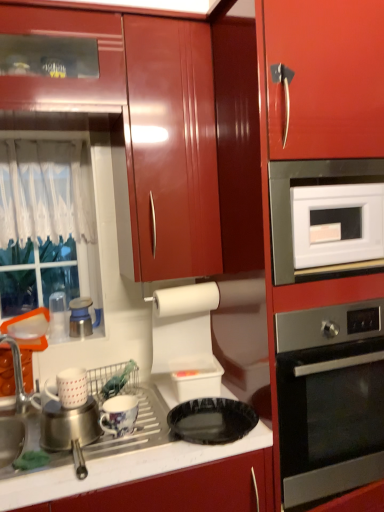
Question: Is black glossy plate at lower center not near glossy ceramic mug at lower center, positioned as the third appliance in left-to-right order?

Choices:
 (A) yes
 (B) no

Answer: (B)

Question: From a real-world perspective, is black glossy plate at lower center positioned under glossy ceramic mug at lower center, marked as the second appliance in a front-to-back arrangement, based on gravity?

Choices:
 (A) no
 (B) yes

Answer: (B)

Question: Is black glossy plate at lower center oriented towards glossy ceramic mug at lower center, which is counted as the 3th appliance, starting from the top?

Choices:
 (A) yes
 (B) no

Answer: (B)

Question: From the image's perspective, is black glossy plate at lower center located above glossy ceramic mug at lower center, positioned as the third appliance in left-to-right order?

Choices:
 (A) no
 (B) yes

Answer: (A)

Question: From the image's perspective, is black glossy plate at lower center under glossy ceramic mug at lower center, which ranks as the second appliance in back-to-front order?

Choices:
 (A) yes
 (B) no

Answer: (A)

Question: Choose the correct answer: Is black glossy plate at lower center inside glossy wood cabinet at upper center or outside it?

Choices:
 (A) outside
 (B) inside

Answer: (A)

Question: From a real-world perspective, is black glossy plate at lower center positioned above or below glossy wood cabinet at upper center?

Choices:
 (A) above
 (B) below

Answer: (B)

Question: Relative to glossy wood cabinet at upper center, is black glossy plate at lower center in front or behind?

Choices:
 (A) front
 (B) behind

Answer: (B)

Question: From the image's perspective, is black glossy plate at lower center positioned above or below glossy wood cabinet at upper center?

Choices:
 (A) below
 (B) above

Answer: (A)

Question: Is point (72, 323) closer or farther from the camera than point (304, 409)?

Choices:
 (A) farther
 (B) closer

Answer: (A)

Question: From a real-world perspective, is satin silver kettle at upper left, which appears as the 1th appliance when viewed from the top, positioned above or below stainless steel oven at right?

Choices:
 (A) below
 (B) above

Answer: (B)

Question: Is satin silver kettle at upper left, which ranks as the third appliance in right-to-left order, taller or shorter than stainless steel oven at right?

Choices:
 (A) short
 (B) tall

Answer: (A)

Question: Would you say satin silver kettle at upper left, the 1th appliance viewed from the back, is inside or outside stainless steel oven at right?

Choices:
 (A) outside
 (B) inside

Answer: (A)

Question: Is glossy wood cabinet at upper center taller or shorter than satin silver kettle at upper left, which appears as the 1th appliance when viewed from the top?

Choices:
 (A) tall
 (B) short

Answer: (A)

Question: Considering the positions of point (107, 14) and point (84, 330), is point (107, 14) closer or farther from the camera than point (84, 330)?

Choices:
 (A) closer
 (B) farther

Answer: (A)